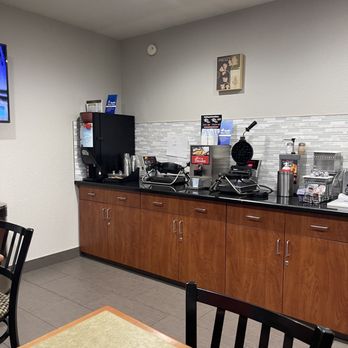
Locate an element on the screen. The image size is (348, 348). cabinet drawers is located at coordinates (99, 195), (153, 200).